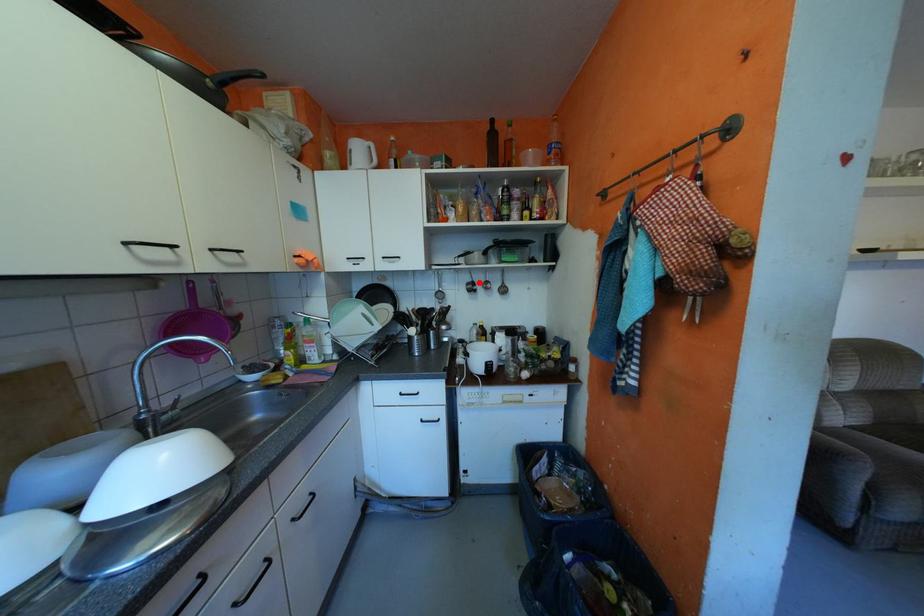
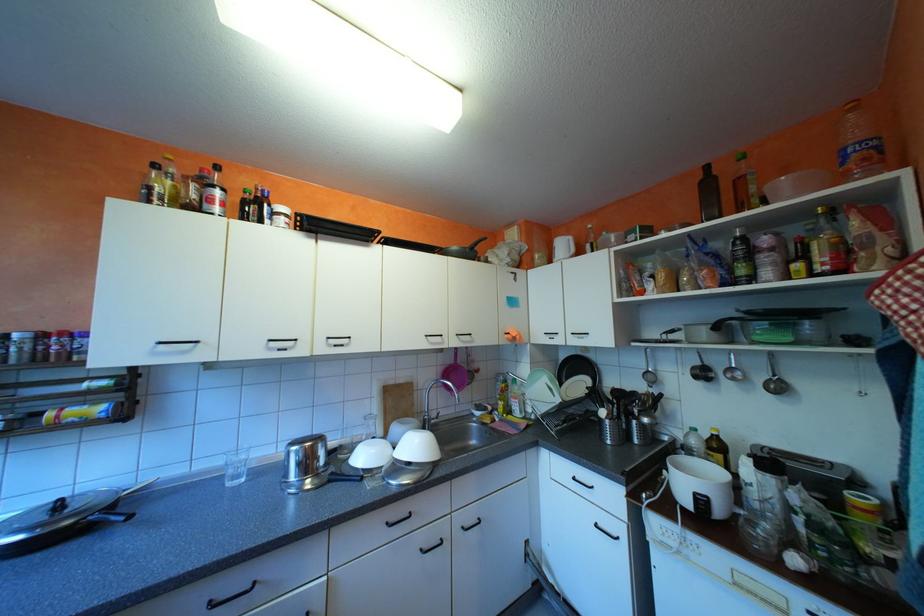
In the second image, find the point that corresponds to the highlighted location in the first image.

(706, 367)